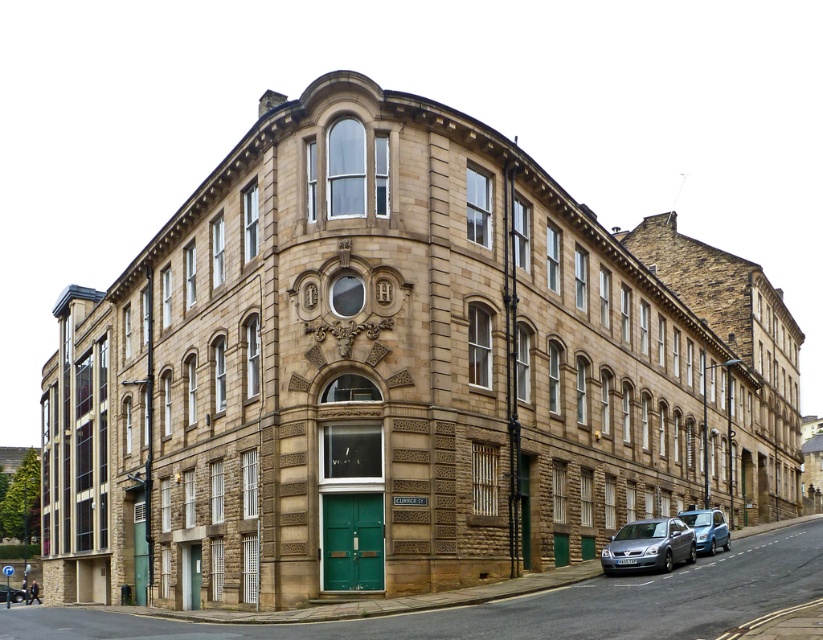
Question: Is silver metallic car at lower right thinner than metallic blue car at lower right?

Choices:
 (A) no
 (B) yes

Answer: (B)

Question: Is silver metallic car at lower right positioned before metallic silver car at lower left?

Choices:
 (A) no
 (B) yes

Answer: (B)

Question: Which of the following is the farthest from the observer?

Choices:
 (A) (700, 529)
 (B) (690, 541)
 (C) (1, 592)

Answer: (C)

Question: Which point appears farthest from the camera in this image?

Choices:
 (A) [689, 545]
 (B) [710, 520]

Answer: (B)

Question: Considering the relative positions of silver metallic car at lower right and metallic blue car at lower right in the image provided, where is silver metallic car at lower right located with respect to metallic blue car at lower right?

Choices:
 (A) right
 (B) left

Answer: (B)

Question: Which object is closer to the camera taking this photo?

Choices:
 (A) silver metallic car at lower right
 (B) metallic silver car at lower left

Answer: (A)